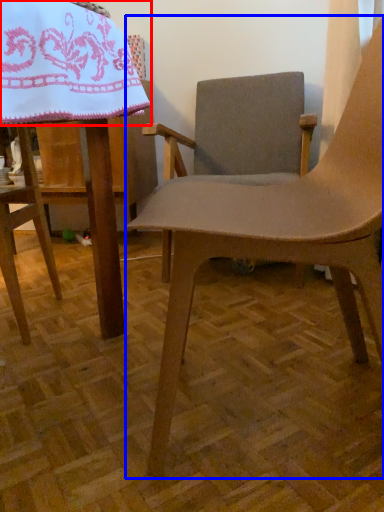
Question: Which object is further to the camera taking this photo, blanket (highlighted by a red box) or chair (highlighted by a blue box)?

Choices:
 (A) blanket
 (B) chair

Answer: (B)